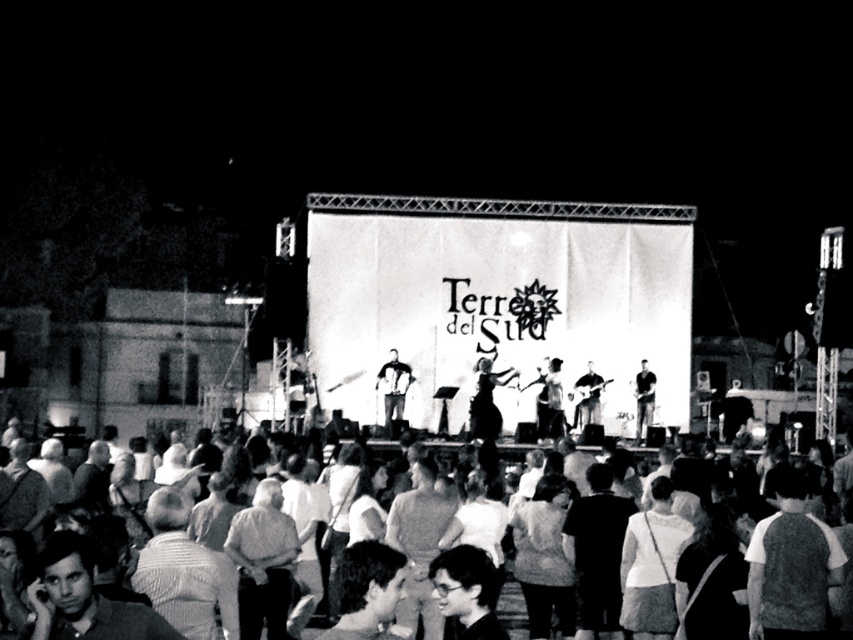
Question: Is smooth fabric crowd at lower center thinner than matte black accordion at center?

Choices:
 (A) no
 (B) yes

Answer: (A)

Question: Can you confirm if smooth black shirt at center is smaller than smooth wood guitar at center?

Choices:
 (A) yes
 (B) no

Answer: (A)

Question: Can you confirm if smooth black shirt at center is thinner than smooth wood guitar at center?

Choices:
 (A) no
 (B) yes

Answer: (B)

Question: Which point is closer to the camera taking this photo?

Choices:
 (A) (469, 417)
 (B) (581, 406)
 (C) (828, 520)
 (D) (550, 433)

Answer: (C)

Question: Estimate the real-world distances between objects in this image. Which object is farther from the smooth black shirt at center?

Choices:
 (A) smooth wood guitar at center
 (B) dark gray fabric guitar at center

Answer: (B)

Question: Which point is closer to the camera?

Choices:
 (A) smooth fabric crowd at lower center
 (B) smooth wood guitar at center
 (C) dark gray fabric guitar at center

Answer: (A)